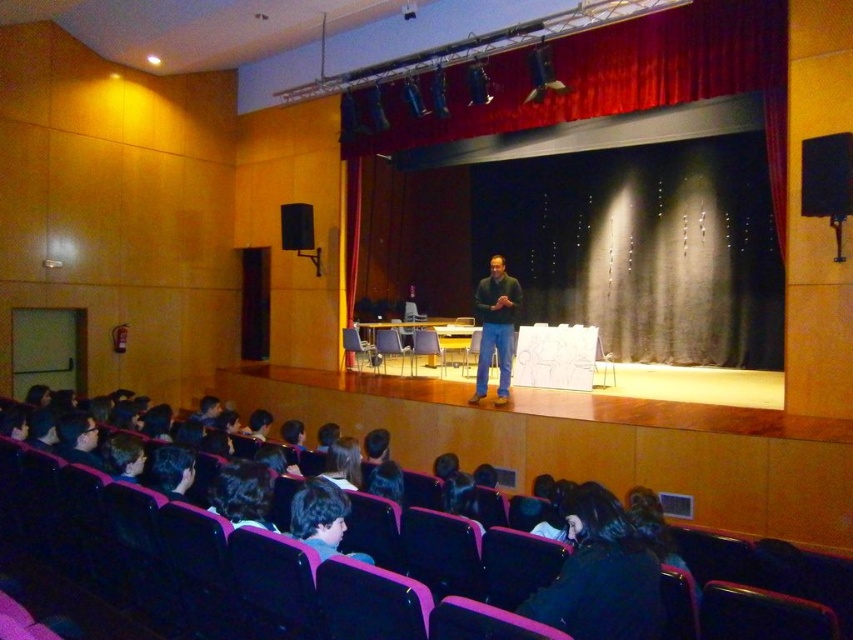
Question: Estimate the real-world distances between objects in this image. Which object is closer to the black fabric at lower center?

Choices:
 (A) dark green sweater at center
 (B) dark brown hair at lower center
 (C) red velvet curtain at upper center

Answer: (B)

Question: Does black fabric at lower center come behind black matte speaker at upper left?

Choices:
 (A) no
 (B) yes

Answer: (A)

Question: Can you confirm if red velvet curtain at upper center is smaller than dark green sweater at center?

Choices:
 (A) yes
 (B) no

Answer: (B)

Question: Among these points, which one is farthest from the camera?

Choices:
 (A) (294, 236)
 (B) (572, 45)

Answer: (A)

Question: Does red velvet curtain at upper center appear on the right side of dark green sweater at center?

Choices:
 (A) no
 (B) yes

Answer: (B)

Question: Which of these objects is positioned farthest from the black fabric at lower center?

Choices:
 (A) black matte speaker at upper left
 (B) dark brown hair at lower center
 (C) dark green sweater at center
 (D) red velvet curtain at upper center

Answer: (A)